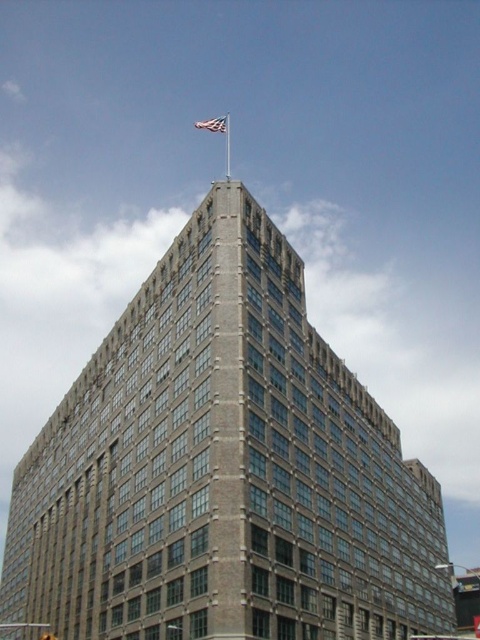
Find the location of `white fabric flag at top`. white fabric flag at top is located at coordinates (214, 124).

Consider the image. Between white fabric flag at top and silver metallic flag pole at upper center, which one is positioned higher?

Positioned higher is white fabric flag at top.

Does point (211, 129) come farther from viewer compared to point (228, 141)?

Yes, point (211, 129) is behind point (228, 141).

Find the location of a particular element. The width and height of the screenshot is (480, 640). white fabric flag at top is located at coordinates (214, 124).